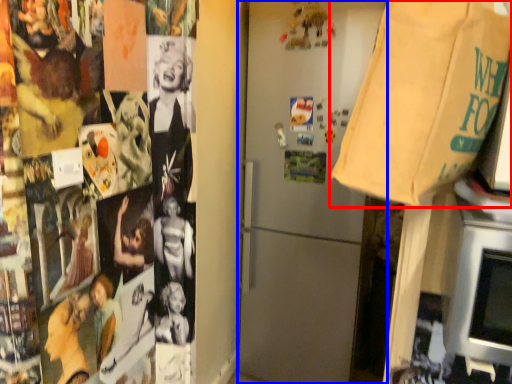
Question: Among these objects, which one is farthest to the camera, grocery bag (highlighted by a red box) or refrigerator (highlighted by a blue box)?

Choices:
 (A) grocery bag
 (B) refrigerator

Answer: (B)